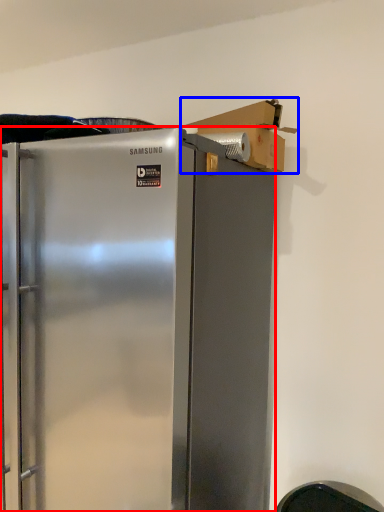
Question: Which object appears closest to the camera in this image, refrigerator (highlighted by a red box) or cardboard box (highlighted by a blue box)?

Choices:
 (A) refrigerator
 (B) cardboard box

Answer: (A)